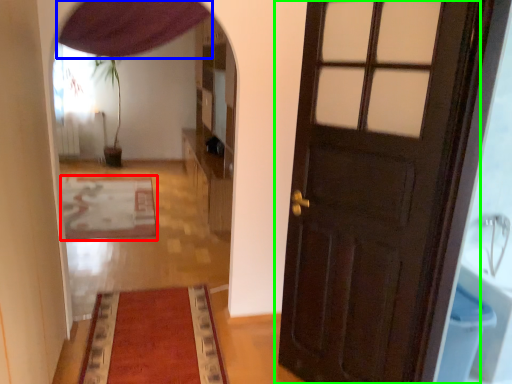
Question: Which object is the farthest from mat (highlighted by a red box)? Choose among these: curtain (highlighted by a blue box) or door (highlighted by a green box).

Choices:
 (A) curtain
 (B) door

Answer: (B)